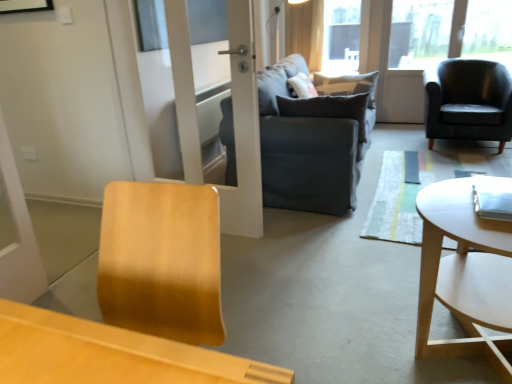
Question: Looking at their shapes, would you say white wood coffee table at right is wider or thinner than light beige fabric curtain at upper center?

Choices:
 (A) thin
 (B) wide

Answer: (B)

Question: From a real-world perspective, is white wood coffee table at right positioned above or below light beige fabric curtain at upper center?

Choices:
 (A) above
 (B) below

Answer: (B)

Question: Which of these objects is positioned farthest from the light beige fabric curtain at upper center?

Choices:
 (A) transparent glass window screen at upper center
 (B) dark gray fabric couch at center
 (C) white wood coffee table at right
 (D) dark gray fabric pillow at center
 (E) matte black armchair at right

Answer: (C)

Question: Based on their relative distances, which object is nearer to the transparent glass window screen at upper center?

Choices:
 (A) white wood coffee table at right
 (B) light beige fabric curtain at upper center
 (C) dark gray fabric pillow at center
 (D) dark gray fabric couch at center
 (E) matte black armchair at right

Answer: (B)